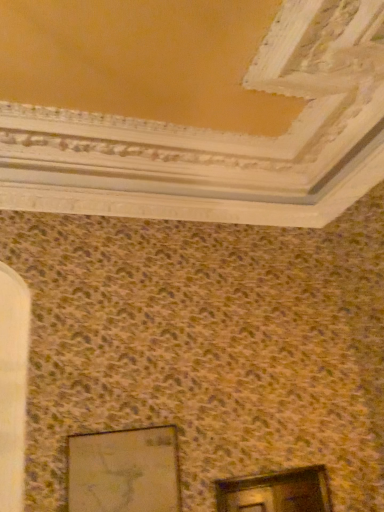
Question: Is matte glass picture frame at lower left inside matte glass window at lower center?

Choices:
 (A) no
 (B) yes

Answer: (A)

Question: Considering the relative sizes of matte glass window at lower center and matte glass picture frame at lower left in the image provided, is matte glass window at lower center thinner than matte glass picture frame at lower left?

Choices:
 (A) no
 (B) yes

Answer: (A)

Question: Considering the relative positions of matte glass window at lower center and matte glass picture frame at lower left in the image provided, is matte glass window at lower center to the left of matte glass picture frame at lower left from the viewer's perspective?

Choices:
 (A) no
 (B) yes

Answer: (A)

Question: Does matte glass window at lower center have a lesser height compared to matte glass picture frame at lower left?

Choices:
 (A) no
 (B) yes

Answer: (B)

Question: Is matte glass window at lower center not within matte glass picture frame at lower left?

Choices:
 (A) yes
 (B) no

Answer: (A)

Question: Is matte glass window at lower center in front of matte glass picture frame at lower left?

Choices:
 (A) yes
 (B) no

Answer: (B)

Question: Can you confirm if matte glass picture frame at lower left is positioned to the right of matte glass window at lower center?

Choices:
 (A) yes
 (B) no

Answer: (B)

Question: Does matte glass picture frame at lower left have a larger size compared to matte glass window at lower center?

Choices:
 (A) no
 (B) yes

Answer: (B)

Question: Considering the relative sizes of matte glass picture frame at lower left and matte glass window at lower center in the image provided, is matte glass picture frame at lower left shorter than matte glass window at lower center?

Choices:
 (A) no
 (B) yes

Answer: (A)

Question: From the image's perspective, is matte glass picture frame at lower left on top of matte glass window at lower center?

Choices:
 (A) no
 (B) yes

Answer: (B)

Question: Does matte glass picture frame at lower left have a greater height compared to matte glass window at lower center?

Choices:
 (A) no
 (B) yes

Answer: (B)

Question: From a real-world perspective, is matte glass picture frame at lower left on top of matte glass window at lower center?

Choices:
 (A) no
 (B) yes

Answer: (B)

Question: In the image, is matte glass window at lower center on the left side or the right side of matte glass picture frame at lower left?

Choices:
 (A) right
 (B) left

Answer: (A)